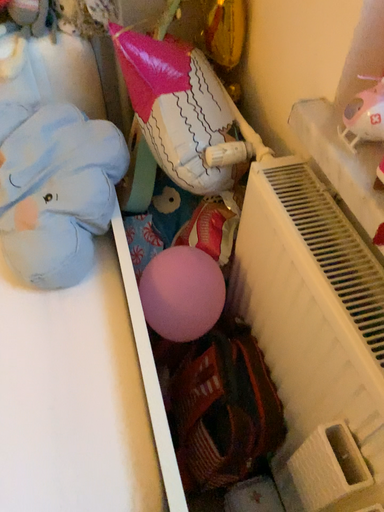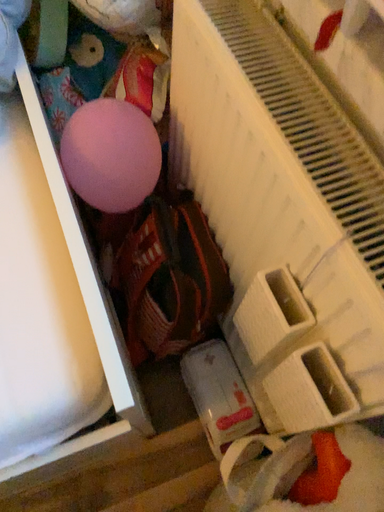
Question: Which way did the camera rotate in the video?

Choices:
 (A) rotated downward
 (B) rotated upward

Answer: (A)